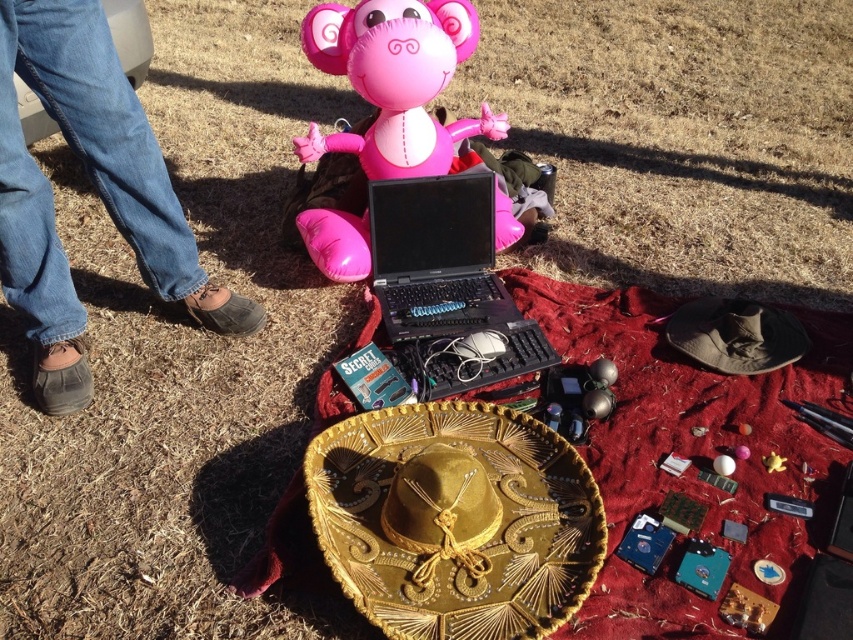
Does pink inflatable monkey at center come behind black plastic laptop at center?

Yes, pink inflatable monkey at center is further from the viewer.

Does point (370, 147) lie in front of point (451, 208)?

No, it is not.

Does point (310, 10) come in front of point (456, 218)?

That is False.

Identify the location of pink inflatable monkey at center. (386, 112).

Is brown suede shoes at lower left below black plastic laptop at center?

Actually, brown suede shoes at lower left is above black plastic laptop at center.

At what (x,y) coordinates should I click in order to perform the action: click on brown suede shoes at lower left. Please return your answer as a coordinate pair (x, y). The width and height of the screenshot is (853, 640). Looking at the image, I should click on (96, 188).

Does brown suede shoes at lower left have a smaller size compared to pink inflatable monkey at center?

Correct, brown suede shoes at lower left occupies less space than pink inflatable monkey at center.

Between point (4, 12) and point (373, 173), which one is positioned behind?

The point (373, 173) is behind.

Does point (45, 17) lie in front of point (457, 141)?

Yes, point (45, 17) is closer to viewer.

You are a GUI agent. You are given a task and a screenshot of the screen. Output one action in this format:
    pyautogui.click(x=<x>, y=<y>)
    Task: Click on the brown suede shoes at lower left
    The height and width of the screenshot is (640, 853).
    Given the screenshot: What is the action you would take?
    (96, 188)